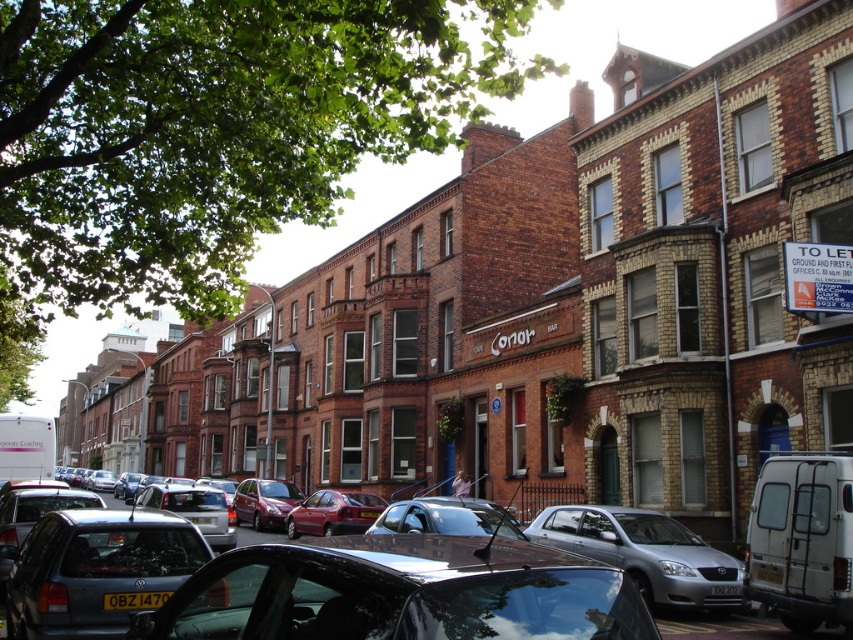
Between silver metallic car at center and black plastic license plate at lower center, which one appears on the right side from the viewer's perspective?

From the viewer's perspective, silver metallic car at center appears more on the right side.

Which is above, silver metallic car at center or black plastic license plate at lower center?

black plastic license plate at lower center is above.

Identify the location of silver metallic car at center. (645, 552).

Is silver metallic car at center positioned behind yellow plastic license plate at center?

Yes, silver metallic car at center is behind yellow plastic license plate at center.

Locate an element on the screen. The height and width of the screenshot is (640, 853). silver metallic car at center is located at coordinates (645, 552).

Does point (674, 564) lie behind point (764, 580)?

Yes, point (674, 564) is farther from viewer.

Find the location of `silver metallic car at center`. silver metallic car at center is located at coordinates (645, 552).

Is black plastic license plate at lower center above yellow plastic license plate at center?

Yes.

Looking at this image, is black plastic license plate at lower center shorter than yellow plastic license plate at center?

Yes, black plastic license plate at lower center is shorter than yellow plastic license plate at center.

Which is behind, point (131, 596) or point (758, 577)?

Positioned behind is point (758, 577).

Identify the location of black plastic license plate at lower center. tap(135, 600).